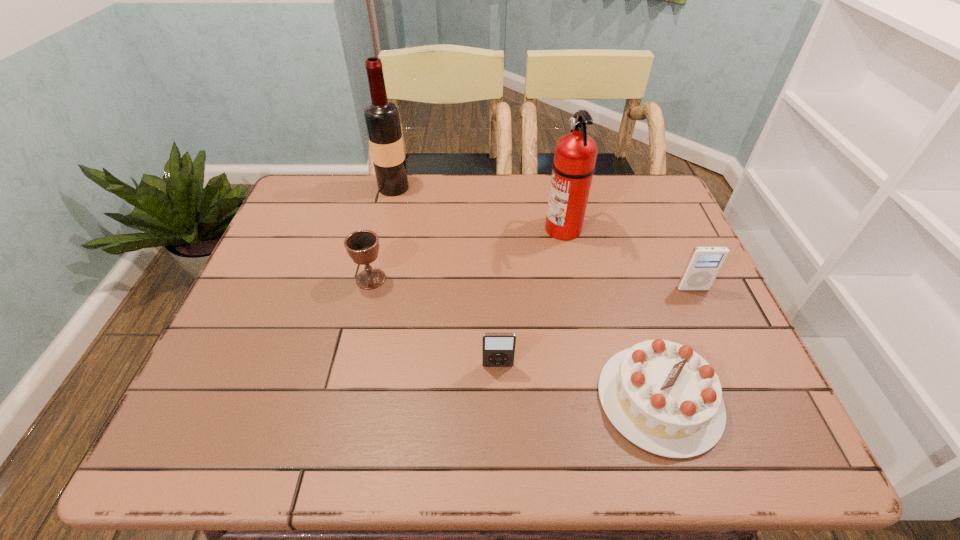
This screenshot has height=540, width=960. I want to click on blank region between the fire extinguisher and the shorter iPod, so click(x=530, y=297).

Locate an element on the screen. The image size is (960, 540). free space that is in between the chalice and the farthest object is located at coordinates (382, 233).

Identify the location of free space between the birthday cake and the fifth nearest object. (612, 314).

At what (x,y) coordinates should I click in order to perform the action: click on vacant space that is in between the farthest object and the chalice. Please return your answer as a coordinate pair (x, y). This screenshot has width=960, height=540. Looking at the image, I should click on (382, 233).

I want to click on vacant space that is in between the shorter iPod and the chalice, so pyautogui.click(x=434, y=322).

At what (x,y) coordinates should I click in order to perform the action: click on vacant space that is in between the fifth nearest object and the nearer iPod. Please return your answer as a coordinate pair (x, y). This screenshot has height=540, width=960. Looking at the image, I should click on (530, 297).

You are a GUI agent. You are given a task and a screenshot of the screen. Output one action in this format:
    pyautogui.click(x=<x>, y=<y>)
    Task: Click on the vacant area that lies between the chalice and the nearer iPod
    Image resolution: width=960 pixels, height=540 pixels.
    Given the screenshot: What is the action you would take?
    pyautogui.click(x=434, y=322)

Find the location of a particular element. The image size is (960, 540). vacant space that is in between the second farthest object and the shorter iPod is located at coordinates (530, 297).

Identify the location of object that is the third closest to the chalice. (575, 155).

Select which object appears as the second closest to the birthday cake. Please provide its 2D coordinates. Your answer should be formatted as a tuple, i.e. [(x, y)], where the tuple contains the x and y coordinates of a point satisfying the conditions above.

[(704, 264)]